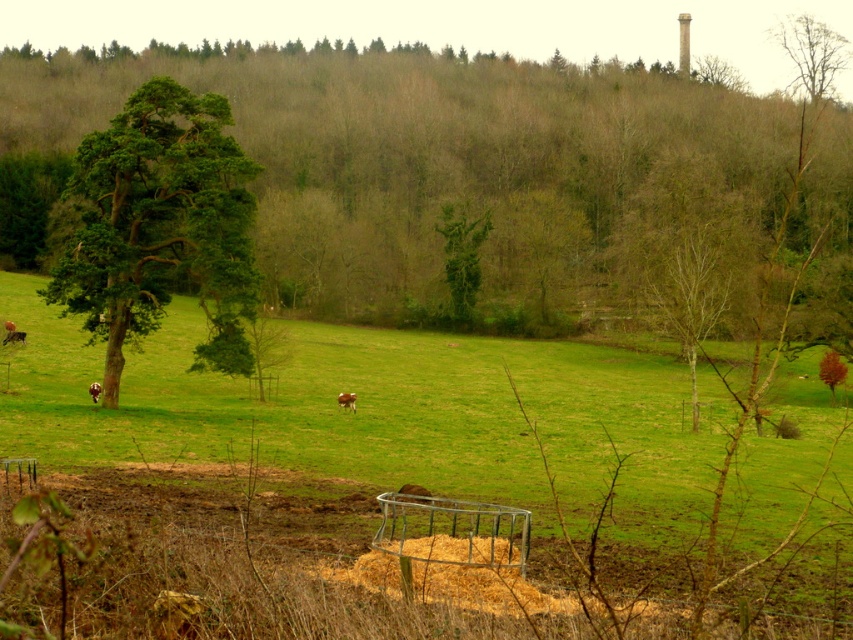
You are standing in the field and want to walk towards the green grass at center and the brown leafy tree at upper right. Which one will you reach first?

You will reach the green grass at center first because it is closer to the viewer than the brown leafy tree at upper right.

You are standing at the point with coordinates 0.5, 0.5. You want to walk to the green grass at center. In which direction should you move?

Since the green grass at center is located at point [386,416] and you are at [426,320], you should move northeast to reach it.